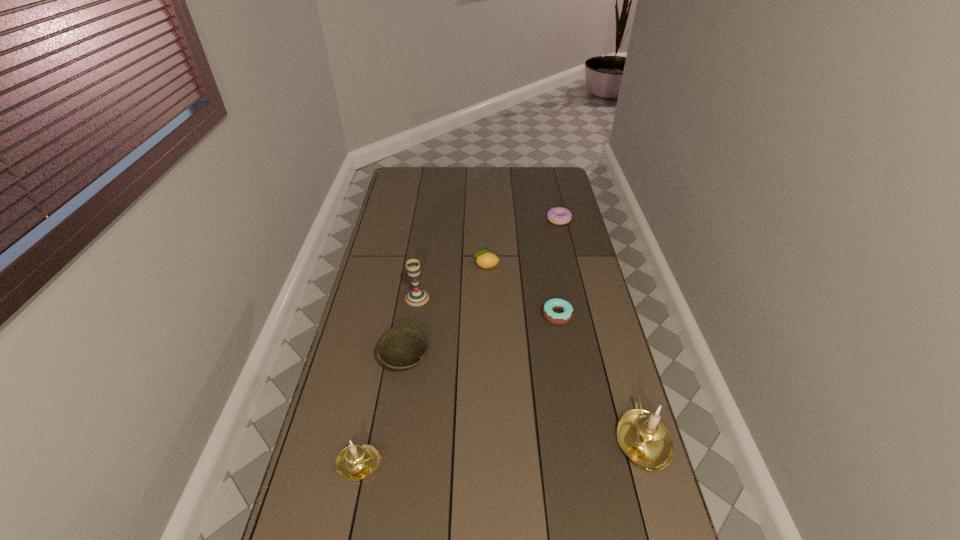
Identify the location of the left candle holder. This screenshot has height=540, width=960. (357, 461).

Identify the location of the third tallest object. (357, 461).

You are a GUI agent. You are given a task and a screenshot of the screen. Output one action in this format:
    pyautogui.click(x=<x>, y=<y>)
    Task: Click on the taller candle holder
    This screenshot has width=960, height=540.
    Given the screenshot: What is the action you would take?
    pyautogui.click(x=643, y=436)

This screenshot has width=960, height=540. In order to click on the farthest object in this screenshot , I will do `click(558, 215)`.

You are a GUI agent. You are given a task and a screenshot of the screen. Output one action in this format:
    pyautogui.click(x=<x>, y=<y>)
    Task: Click on the taller doughnut
    The width and height of the screenshot is (960, 540).
    Given the screenshot: What is the action you would take?
    pyautogui.click(x=558, y=215)

The height and width of the screenshot is (540, 960). What are the coordinates of `bowl` in the screenshot? It's located at (403, 347).

This screenshot has height=540, width=960. Find the location of `the shorter doughnut`. the shorter doughnut is located at coordinates (557, 318).

The image size is (960, 540). Identify the location of the nearer doughnut. (x=557, y=318).

The image size is (960, 540). I want to click on lemon, so click(485, 259).

You are a GUI agent. You are given a task and a screenshot of the screen. Output one action in this format:
    pyautogui.click(x=<x>, y=<y>)
    Task: Click on the sixth nearest object
    The height and width of the screenshot is (540, 960).
    Given the screenshot: What is the action you would take?
    pyautogui.click(x=485, y=259)